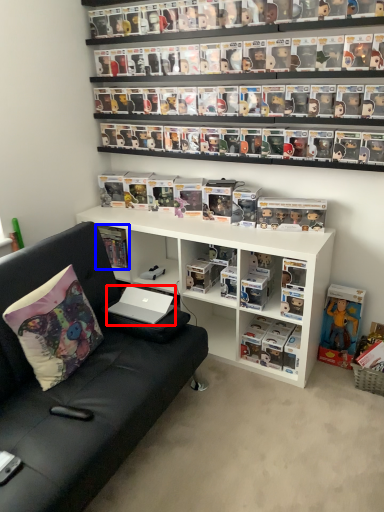
Question: Which of the following is the closest to the observer, laptop (highlighted by a red box) or book (highlighted by a blue box)?

Choices:
 (A) laptop
 (B) book

Answer: (A)